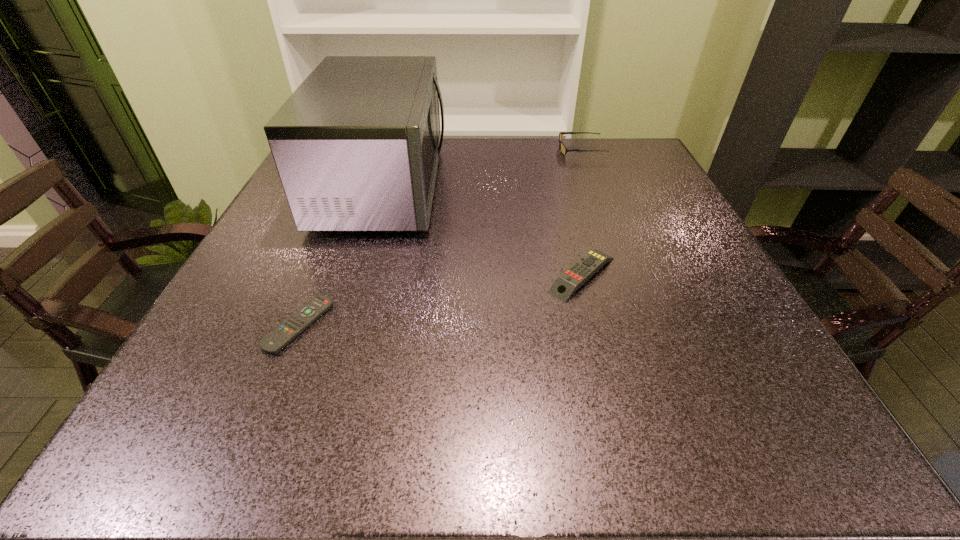
You are a GUI agent. You are given a task and a screenshot of the screen. Output one action in this format:
    pyautogui.click(x=<x>, y=<y>)
    Task: Click on the vacant point located on the back of the right remote control
    The height and width of the screenshot is (540, 960).
    Given the screenshot: What is the action you would take?
    pyautogui.click(x=571, y=233)

What are the coordinates of `vacant space situated on the front of the shorter remote control` in the screenshot? It's located at (273, 388).

At what (x,y) coordinates should I click in order to perform the action: click on microwave oven that is at the far edge. Please return your answer as a coordinate pair (x, y). The image size is (960, 540). Looking at the image, I should click on (356, 146).

Where is `sunglasses located in the far edge section of the desktop`? This screenshot has height=540, width=960. sunglasses located in the far edge section of the desktop is located at coordinates (564, 150).

Locate an element on the screen. microwave oven at the left edge is located at coordinates (356, 146).

At what (x,y) coordinates should I click in order to perform the action: click on remote control that is positioned at the left edge. Please return your answer as a coordinate pair (x, y). The width and height of the screenshot is (960, 540). Looking at the image, I should click on (300, 320).

You are a GUI agent. You are given a task and a screenshot of the screen. Output one action in this format:
    pyautogui.click(x=<x>, y=<y>)
    Task: Click on the object at the right edge
    Image resolution: width=960 pixels, height=540 pixels.
    Given the screenshot: What is the action you would take?
    pyautogui.click(x=564, y=150)

I want to click on object that is at the far left corner, so click(356, 146).

Identify the location of object at the far right corner. This screenshot has height=540, width=960. (564, 150).

The width and height of the screenshot is (960, 540). Find the location of `free space at the far edge`. free space at the far edge is located at coordinates (518, 163).